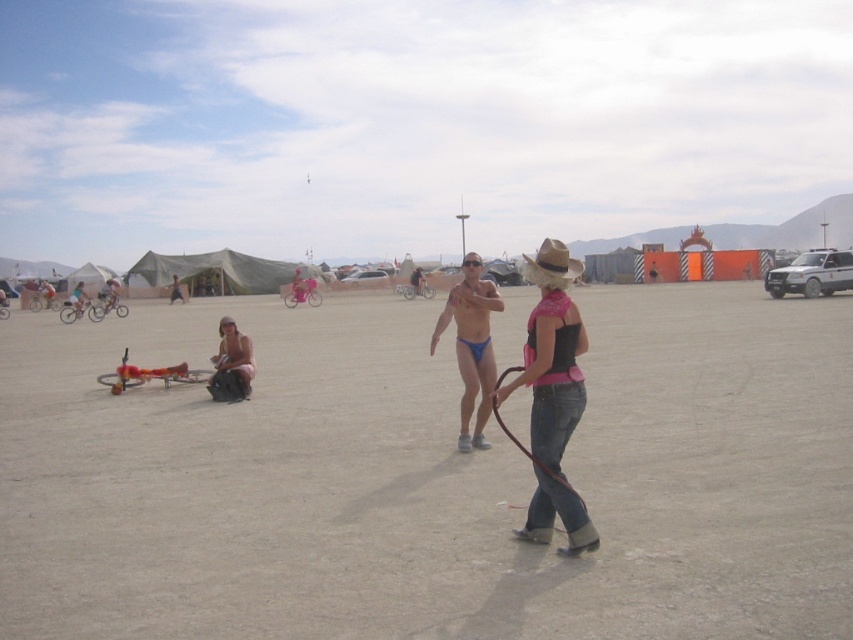
Question: Based on their relative distances, which object is nearer to the brown straw cowboy hat at center?

Choices:
 (A) dull gray sand at center
 (B) matte pink bikini at center
 (C) matte blue swimwear at center

Answer: (C)

Question: Which point appears farthest from the camera in this image?

Choices:
 (A) (228, 401)
 (B) (498, 385)
 (C) (494, 301)

Answer: (A)

Question: Considering the relative positions of pink bandana at center and matte blue swimwear at center in the image provided, where is pink bandana at center located with respect to matte blue swimwear at center?

Choices:
 (A) left
 (B) right

Answer: (B)

Question: Which point is closer to the camera taking this photo?

Choices:
 (A) (527, 452)
 (B) (477, 336)

Answer: (A)

Question: Is matte blue swimwear at center closer to camera compared to matte pink bikini at center?

Choices:
 (A) yes
 (B) no

Answer: (A)

Question: Is matte pink bikini at center further to camera compared to brown straw cowboy hat at center?

Choices:
 (A) yes
 (B) no

Answer: (A)